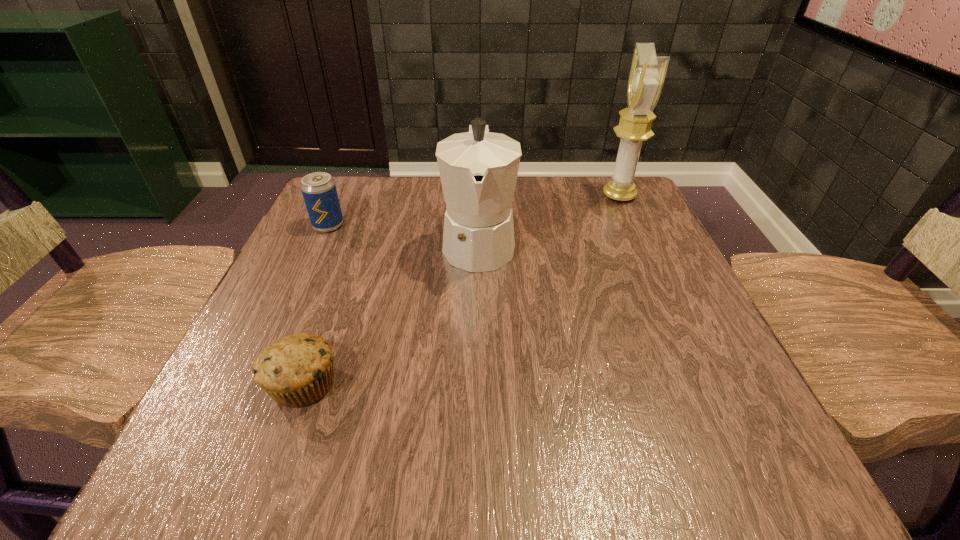
You are a GUI agent. You are given a task and a screenshot of the screen. Output one action in this format:
    pyautogui.click(x=<x>, y=<y>)
    Task: Click on the object that is positioned at the far right corner
    The image size is (960, 540).
    Given the screenshot: What is the action you would take?
    pyautogui.click(x=647, y=73)

Where is `vacant space at the far edge`? vacant space at the far edge is located at coordinates (436, 211).

In the image, there is a desktop. At what (x,y) coordinates should I click in order to perform the action: click on free space at the left edge. Please return your answer as a coordinate pair (x, y). This screenshot has width=960, height=540. Looking at the image, I should click on (320, 274).

Where is `vacant area at the right edge`? Image resolution: width=960 pixels, height=540 pixels. vacant area at the right edge is located at coordinates (650, 270).

Identify the location of vacant position at the far left corner of the desktop. This screenshot has width=960, height=540. (347, 210).

The height and width of the screenshot is (540, 960). What are the coordinates of `vacant space at the near left corner of the desktop` in the screenshot? It's located at (259, 478).

I want to click on empty space between the shortest object and the third shortest object, so click(x=392, y=313).

The height and width of the screenshot is (540, 960). Find the location of `free point between the muffin and the tallest object`. free point between the muffin and the tallest object is located at coordinates (462, 290).

Where is `empty space that is in between the beer can and the shortest object`? This screenshot has width=960, height=540. empty space that is in between the beer can and the shortest object is located at coordinates (316, 305).

I want to click on free point between the coffeepot and the second shortest object, so click(403, 234).